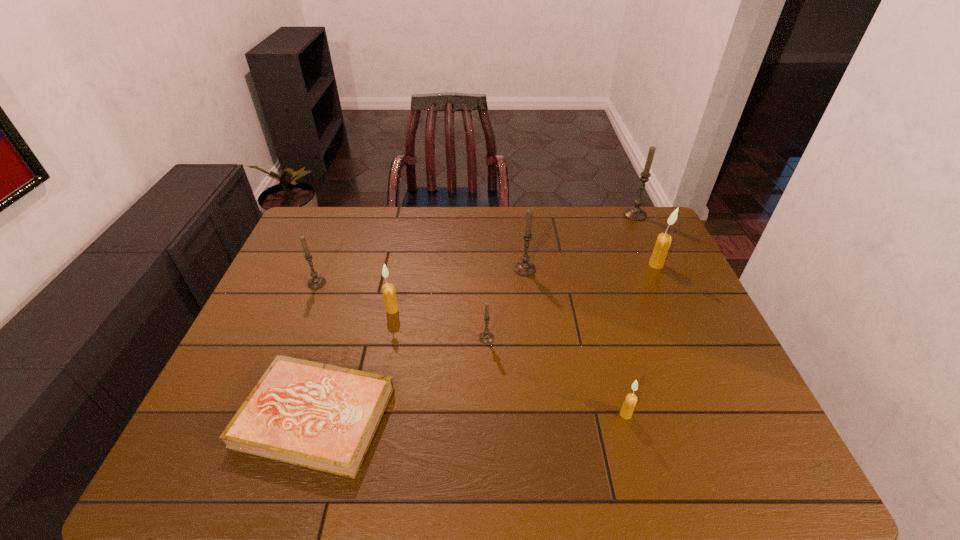
I want to click on free space located on the right of the sixth farthest object, so click(x=610, y=338).

Locate an element on the screen. This screenshot has width=960, height=540. free region located 0.090m on the back of the nearest candle is located at coordinates (615, 377).

The height and width of the screenshot is (540, 960). Find the location of `free point located on the right of the hardback book`. free point located on the right of the hardback book is located at coordinates (508, 417).

Where is `object present at the far edge`? This screenshot has height=540, width=960. object present at the far edge is located at coordinates (635, 213).

You are a GUI agent. You are given a task and a screenshot of the screen. Output one action in this format:
    pyautogui.click(x=<x>, y=<y>)
    Task: Click on the object at the near edge
    The image size is (960, 540).
    Given the screenshot: What is the action you would take?
    pyautogui.click(x=319, y=416)

Find the location of a particular element. candle located at the left edge is located at coordinates (316, 282).

Identify the location of hardback book located in the left edge section of the desktop. click(319, 416).

This screenshot has height=540, width=960. In order to click on object that is at the near left corner in this screenshot , I will do `click(319, 416)`.

Locate an element on the screen. object that is positioned at the far right corner is located at coordinates (635, 213).

Locate an element on the screen. free spot at the far edge of the desktop is located at coordinates (576, 224).